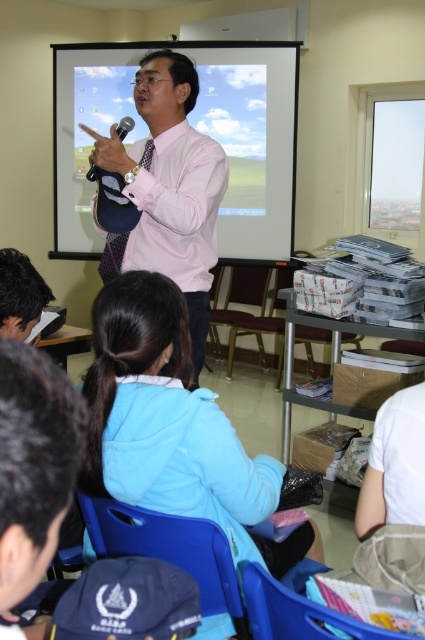
You are a student sitting in the classroom and want to take a photo of the point at coordinates (130, 353). If your camera has a focal length of 50mm and you are currently 3 meters away from the point, should you move closer or farther away to focus properly?

The point at coordinates (130, 353) is 1.25 meters away from the camera. Since you are currently 3 meters away, you need to move closer to 1.25 meters to focus properly.

You are a student sitting in the classroom and want to describe the presenter to your friend. Which object is taller, the pink shirt at center or the matte black microphone at upper center?

The pink shirt at center is taller than the matte black microphone at upper center.

A student wants to place a 30 inch wide poster between the blue fleece jacket at lower center and the pink shirt at center. Is there enough space?

The blue fleece jacket at lower center is 29.18 inches from the pink shirt at center, so the poster cannot fit as it is wider than the available space.